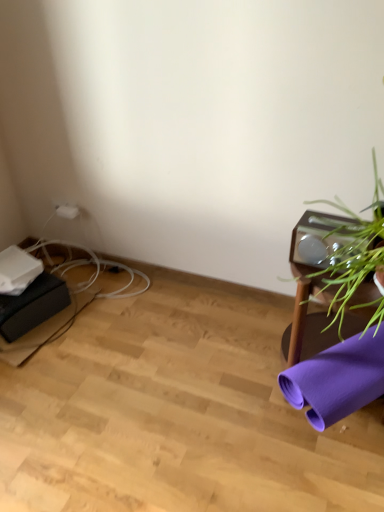
Question: Does purple fabric yoga mat at lower right touch white plastic plug at upper left?

Choices:
 (A) no
 (B) yes

Answer: (A)

Question: From the image's perspective, is purple fabric yoga mat at lower right below white plastic plug at upper left?

Choices:
 (A) no
 (B) yes

Answer: (B)

Question: From the image's perspective, would you say purple fabric yoga mat at lower right is positioned over white plastic plug at upper left?

Choices:
 (A) yes
 (B) no

Answer: (B)

Question: Does purple fabric yoga mat at lower right have a larger size compared to white plastic plug at upper left?

Choices:
 (A) no
 (B) yes

Answer: (B)

Question: Considering the relative positions of purple fabric yoga mat at lower right and white plastic plug at upper left in the image provided, is purple fabric yoga mat at lower right to the left of white plastic plug at upper left from the viewer's perspective?

Choices:
 (A) yes
 (B) no

Answer: (B)

Question: From a real-world perspective, is white plastic plug at upper left positioned above or below purple fabric yoga mat at lower right?

Choices:
 (A) above
 (B) below

Answer: (A)

Question: Looking at their shapes, would you say white plastic plug at upper left is wider or thinner than purple fabric yoga mat at lower right?

Choices:
 (A) wide
 (B) thin

Answer: (B)

Question: Relative to purple fabric yoga mat at lower right, is white plastic plug at upper left in front or behind?

Choices:
 (A) behind
 (B) front

Answer: (A)

Question: Considering the relative positions of white plastic plug at upper left and purple fabric yoga mat at lower right in the image provided, is white plastic plug at upper left to the left or to the right of purple fabric yoga mat at lower right?

Choices:
 (A) left
 (B) right

Answer: (A)

Question: In terms of size, does green leafy plant at right appear bigger or smaller than white plastic plug at upper left?

Choices:
 (A) big
 (B) small

Answer: (A)

Question: Is green leafy plant at right in front of or behind white plastic plug at upper left in the image?

Choices:
 (A) behind
 (B) front

Answer: (B)

Question: Is point (291, 365) closer or farther from the camera than point (56, 211)?

Choices:
 (A) farther
 (B) closer

Answer: (B)

Question: Considering the relative positions of green leafy plant at right and white plastic plug at upper left in the image provided, is green leafy plant at right to the left or to the right of white plastic plug at upper left?

Choices:
 (A) left
 (B) right

Answer: (B)

Question: From the image's perspective, relative to green leafy plant at right, is white plastic plug at upper left above or below?

Choices:
 (A) below
 (B) above

Answer: (B)

Question: Is white plastic plug at upper left inside the boundaries of green leafy plant at right, or outside?

Choices:
 (A) outside
 (B) inside

Answer: (A)